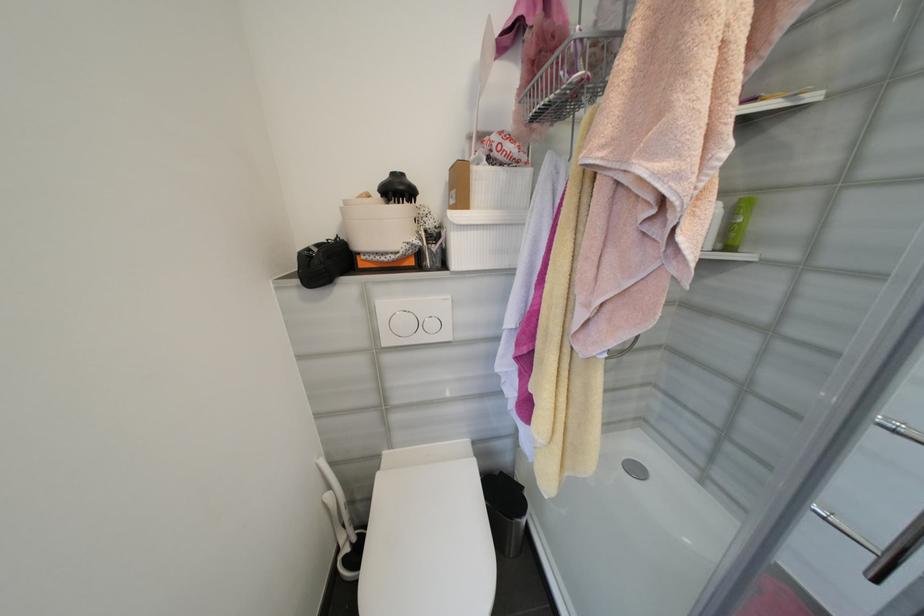
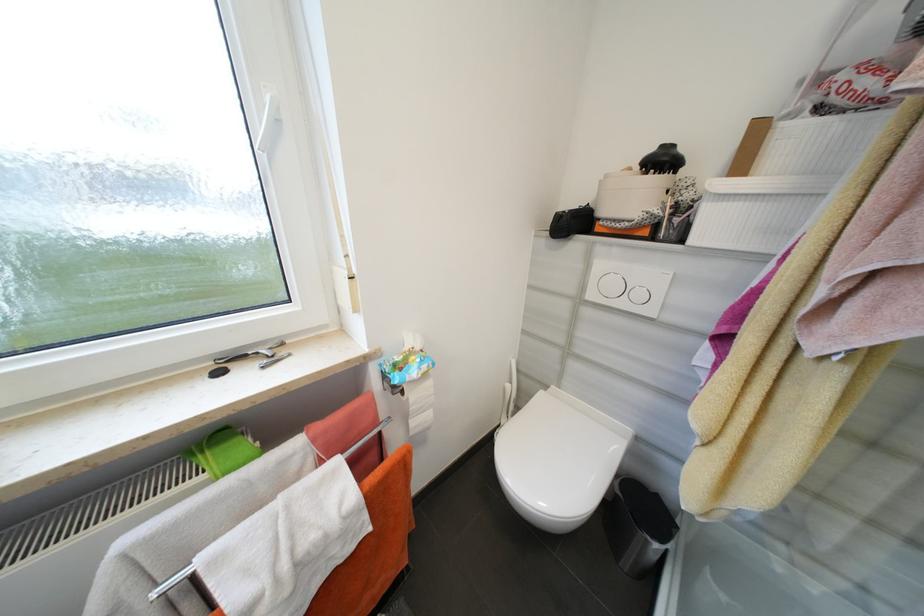
In the second image, find the point that corresponds to pixel 451 267 in the first image.

(687, 241)